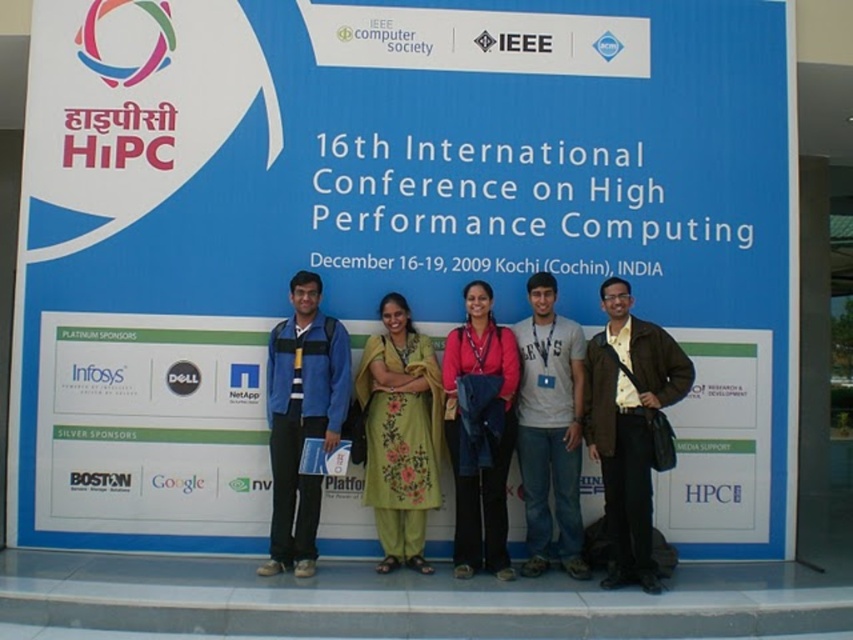
You are standing at the back of the conference hall and see the blue fabric jacket at center. If you want to take a photo of the jacket, will you need to use the zoom feature on your camera?

The blue fabric jacket at center is 6.33 meters away from the camera. Since it is relatively far away, you would likely need to use the zoom feature on your camera to capture a clear image of the jacket.

You are attending the HiPC conference and notice two jackets hanging on a coat rack in the registration area. The brown leather jacket at center and the blue fabric jacket at center are both present. Which jacket is closer to the floor?

The brown leather jacket at center is closer to the floor because it is positioned under the blue fabric jacket at center.